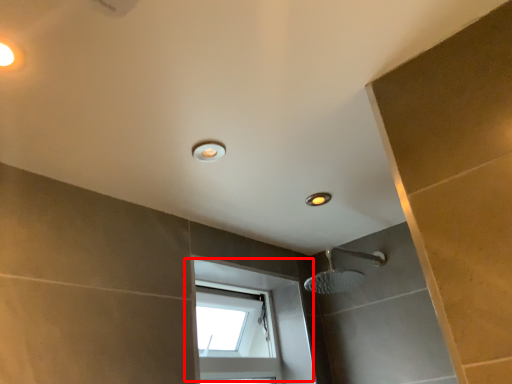
Question: In this image, where is window (annotated by the red box) located relative to light fixture?

Choices:
 (A) left
 (B) right

Answer: (B)